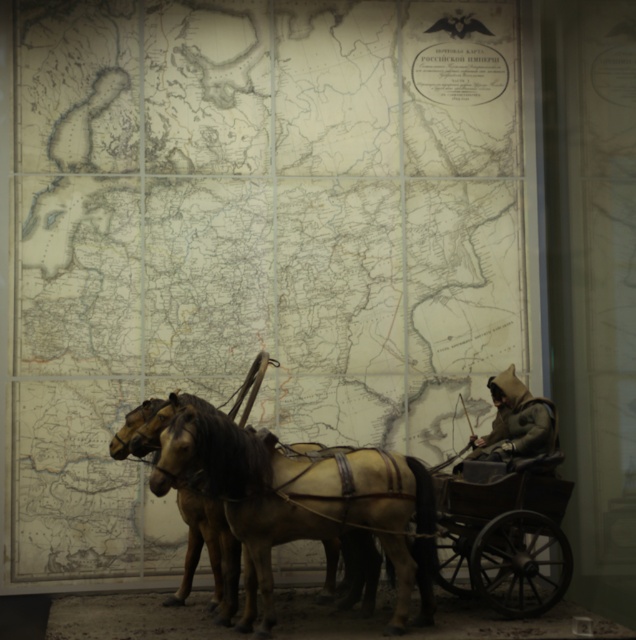
Question: Estimate the real-world distances between objects in this image. Which object is farther from the green felt hat at right?

Choices:
 (A) light brown leather horse cart at center
 (B) brown leather horse at center

Answer: (B)

Question: Does light brown leather horse cart at center have a lesser width compared to green felt hat at right?

Choices:
 (A) yes
 (B) no

Answer: (B)

Question: Considering the relative positions of light brown leather horse cart at center and green felt hat at right in the image provided, where is light brown leather horse cart at center located with respect to green felt hat at right?

Choices:
 (A) above
 (B) below

Answer: (B)

Question: Which object is positioned farthest from the brown leather horse at center?

Choices:
 (A) green felt hat at right
 (B) light brown leather horse cart at center

Answer: (A)

Question: Which object is closer to the camera taking this photo?

Choices:
 (A) brown leather horse at center
 (B) green felt hat at right

Answer: (A)

Question: Does light brown leather horse cart at center have a larger size compared to brown leather horse at center?

Choices:
 (A) no
 (B) yes

Answer: (B)